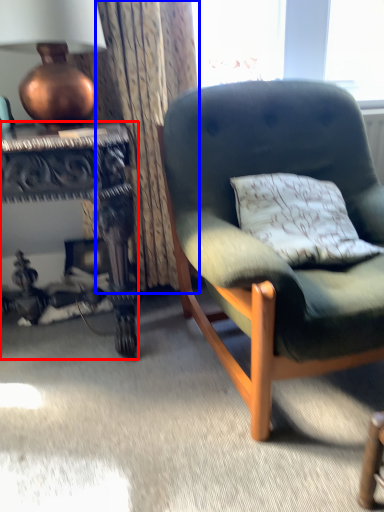
Question: Which point is closer to the camera, desk (highlighted by a red box) or curtain (highlighted by a blue box)?

Choices:
 (A) desk
 (B) curtain

Answer: (A)